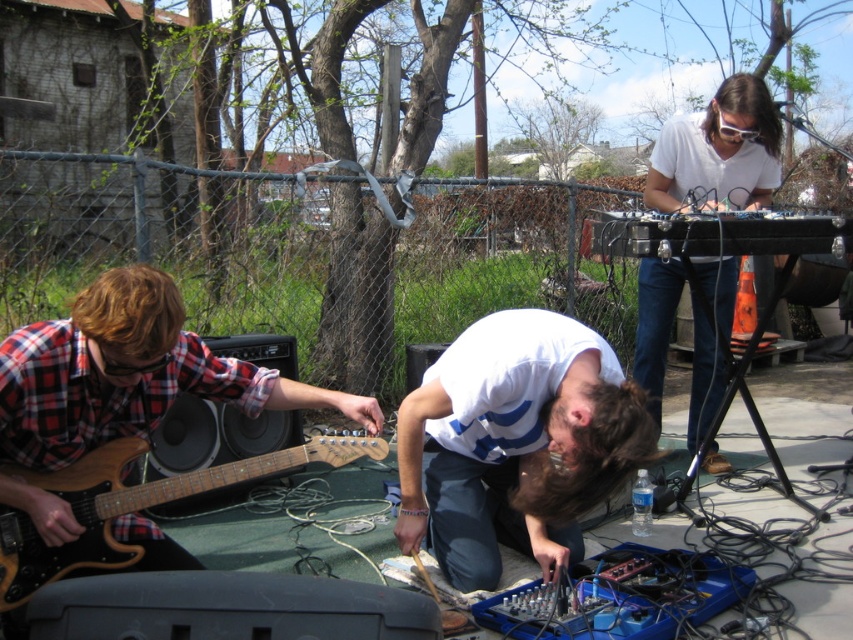
Consider the image. You are a photographer trying to capture a clear shot of the white matte shirt at center and the wooden electric guitar at lower left. Based on their positions, which one is closer to the camera?

The white matte shirt at center is above the wooden electric guitar at lower left, so it is closer to the camera.